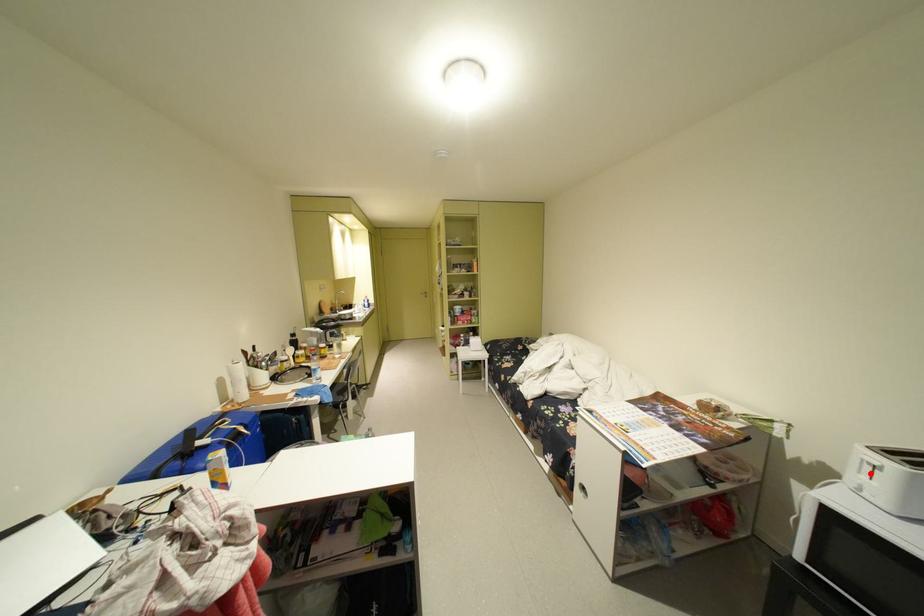
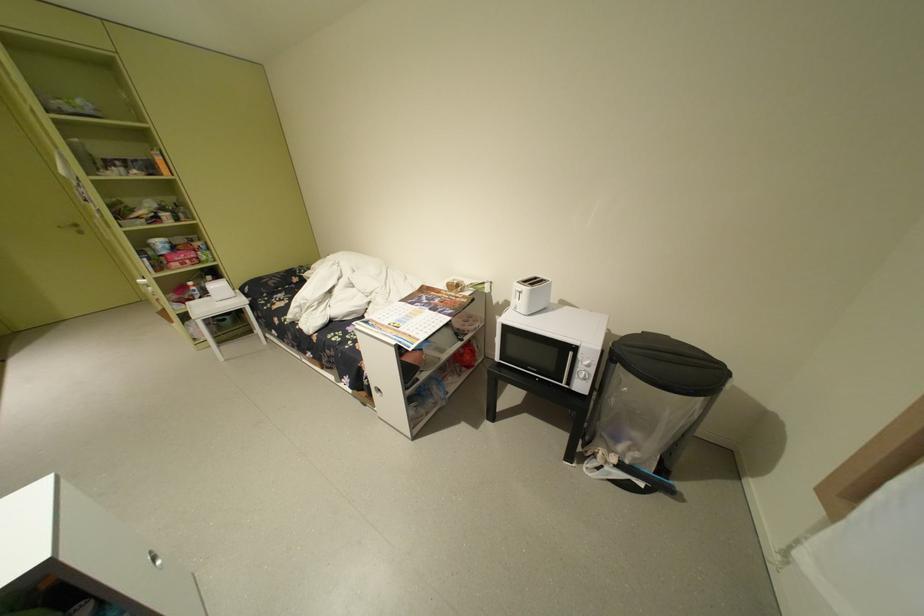
Find the pixel in the second image that matches the highlighted location in the first image.

(527, 299)